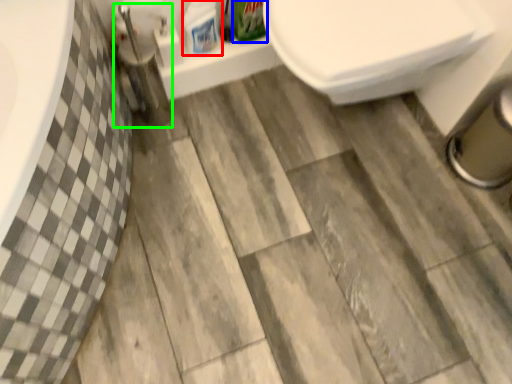
Question: Considering the real-world distances, which object is closest to cleaning product (highlighted by a red box)? cleaning product (highlighted by a blue box) or plumbing fixture (highlighted by a green box).

Choices:
 (A) cleaning product
 (B) plumbing fixture

Answer: (A)